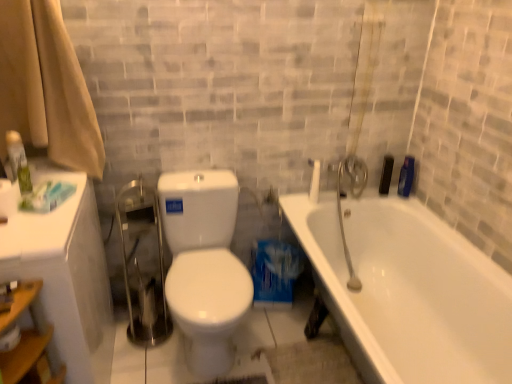
Locate an element on the screen. Image resolution: width=512 pixels, height=384 pixels. black plastic razor at upper right, placed as the 1th toiletry when sorted from back to front is located at coordinates (386, 175).

At what (x,y) coordinates should I click in order to perform the action: click on green matte spray can at left, which is the 3th toiletry in right-to-left order. Please return your answer as a coordinate pair (x, y). Looking at the image, I should click on [x=18, y=161].

The height and width of the screenshot is (384, 512). Describe the element at coordinates (18, 161) in the screenshot. I see `green matte spray can at left, the 3th toiletry when ordered from back to front` at that location.

Find the location of a particular element. white glossy bathtub at right is located at coordinates (408, 291).

In order to face white glossy bathtub at right, should I rotate leftwards or rightwards?

Turn right by 17.511 degrees to look at white glossy bathtub at right.

Where is `white glossy medicine cabinet at left`? This screenshot has height=384, width=512. white glossy medicine cabinet at left is located at coordinates (66, 275).

At what (x,y) coordinates should I click in order to perform the action: click on white matte toilet paper at lower left. Please return your answer as a coordinate pair (x, y). Looking at the image, I should click on (10, 338).

This screenshot has height=384, width=512. I want to click on toiletry lying in front of the blue glossy bottle at upper right, the third toiletry from the left, so click(x=18, y=161).

Could you measure the distance between blue glossy bottle at upper right, acting as the 2th toiletry starting from the back, and green matte spray can at left, which is the 3th toiletry in right-to-left order?

blue glossy bottle at upper right, acting as the 2th toiletry starting from the back, and green matte spray can at left, which is the 3th toiletry in right-to-left order, are 1.74 meters apart from each other.

How many degrees apart are the facing directions of blue glossy bottle at upper right, acting as the 2th toiletry starting from the back, and green matte spray can at left, which appears as the first toiletry when viewed from the front?

84.4 degrees separate the facing orientations of blue glossy bottle at upper right, acting as the 2th toiletry starting from the back, and green matte spray can at left, which appears as the first toiletry when viewed from the front.

From the image's perspective, relative to green matte spray can at left, arranged as the first toiletry when viewed from the left, is blue glossy bottle at upper right, acting as the 2th toiletry starting from the back, above or below?

From the image's perspective, blue glossy bottle at upper right, acting as the 2th toiletry starting from the back, appears below green matte spray can at left, arranged as the first toiletry when viewed from the left.

Is beige fabric shower curtain at left in front of or behind black plastic razor at upper right, placed as the 1th toiletry when sorted from back to front, in the image?

Clearly, beige fabric shower curtain at left is in front of black plastic razor at upper right, placed as the 1th toiletry when sorted from back to front.

Considering the positions of objects beige fabric shower curtain at left and black plastic razor at upper right, which appears as the 2th toiletry when viewed from the right, in the image provided, who is more to the left, beige fabric shower curtain at left or black plastic razor at upper right, which appears as the 2th toiletry when viewed from the right,?

beige fabric shower curtain at left is more to the left.

Considering the relative sizes of beige fabric shower curtain at left and black plastic razor at upper right, placed as the 1th toiletry when sorted from back to front, in the image provided, is beige fabric shower curtain at left bigger than black plastic razor at upper right, placed as the 1th toiletry when sorted from back to front,?

Correct, beige fabric shower curtain at left is larger in size than black plastic razor at upper right, placed as the 1th toiletry when sorted from back to front.

Is beige fabric shower curtain at left aimed at black plastic razor at upper right, which is the third toiletry in front-to-back order?

No, beige fabric shower curtain at left is not aimed at black plastic razor at upper right, which is the third toiletry in front-to-back order.

From the image's perspective, is blue glossy bottle at upper right, arranged as the second toiletry when viewed from the front, beneath white glossy bathtub at right?

No, from the image's perspective, blue glossy bottle at upper right, arranged as the second toiletry when viewed from the front, is not beneath white glossy bathtub at right.

Is the position of blue glossy bottle at upper right, acting as the 2th toiletry starting from the back, more distant than that of white glossy bathtub at right?

Yes, it is.

Based on the photo, is blue glossy bottle at upper right, the 1th toiletry when ordered from right to left, placed right next to white glossy bathtub at right?

blue glossy bottle at upper right, the 1th toiletry when ordered from right to left, and white glossy bathtub at right are clearly separated.

Considering the relative sizes of white glossy medicine cabinet at left and white glossy bathtub at right in the image provided, is white glossy medicine cabinet at left thinner than white glossy bathtub at right?

Correct, the width of white glossy medicine cabinet at left is less than that of white glossy bathtub at right.

Considering the relative sizes of white glossy medicine cabinet at left and white glossy bathtub at right in the image provided, is white glossy medicine cabinet at left taller than white glossy bathtub at right?

Indeed, white glossy medicine cabinet at left has a greater height compared to white glossy bathtub at right.

Is white glossy medicine cabinet at left spatially inside white glossy bathtub at right, or outside of it?

The correct answer is: outside.

From a real-world perspective, does white glossy medicine cabinet at left sit lower than white glossy bathtub at right?

Incorrect, from a real-world perspective, white glossy medicine cabinet at left is higher than white glossy bathtub at right.

From a real-world perspective, relative to white glossy medicine cabinet at left, is blue glossy bottle at upper right, arranged as the second toiletry when viewed from the front, vertically above or below?

From a real-world perspective, blue glossy bottle at upper right, arranged as the second toiletry when viewed from the front, is physically above white glossy medicine cabinet at left.

How different are the orientations of blue glossy bottle at upper right, the 1th toiletry when ordered from right to left, and white glossy medicine cabinet at left in degrees?

The facing directions of blue glossy bottle at upper right, the 1th toiletry when ordered from right to left, and white glossy medicine cabinet at left are 90 degrees apart.

Does blue glossy bottle at upper right, the third toiletry from the left, come behind white glossy medicine cabinet at left?

Yes, it is behind white glossy medicine cabinet at left.

Consider the image. Does blue glossy bottle at upper right, acting as the 2th toiletry starting from the back, have a lesser height compared to white glossy medicine cabinet at left?

Indeed, blue glossy bottle at upper right, acting as the 2th toiletry starting from the back, has a lesser height compared to white glossy medicine cabinet at left.

Find the location of a particular element. The image size is (512, 384). toilet located on the left of white glossy bathtub at right is located at coordinates (204, 266).

Could you tell me if white glossy bathtub at right is facing white glossy toilet at center?

No.

In the scene shown: Which point is more forward, (319, 228) or (187, 212)?

The point (187, 212) is more forward.

Image resolution: width=512 pixels, height=384 pixels. There is a white glossy toilet at center. What are the coordinates of `the 2nd toiletry above it (from a real-world perspective)` in the screenshot? It's located at (406, 177).

Can you tell me how much white glossy toilet at center and blue glossy bottle at upper right, the third toiletry from the left, differ in facing direction?

The facing directions of white glossy toilet at center and blue glossy bottle at upper right, the third toiletry from the left, are 0.000193 degrees apart.

Visually, is white glossy toilet at center positioned to the left or to the right of blue glossy bottle at upper right, the third toiletry from the left?

Based on their positions, white glossy toilet at center is located to the left of blue glossy bottle at upper right, the third toiletry from the left.

Is white glossy toilet at center in front of blue glossy bottle at upper right, the 1th toiletry when ordered from right to left?

Yes, it is.

The height and width of the screenshot is (384, 512). What are the coordinates of `toiletry that is the 2nd object located below the green matte spray can at left, which is the 3th toiletry in right-to-left order (from the image's perspective)` in the screenshot? It's located at (406, 177).

The image size is (512, 384). I want to click on shower curtain above the black plastic razor at upper right, placed as the 1th toiletry when sorted from back to front (from the image's perspective), so click(46, 87).

When comparing their distances from white matte toilet paper at lower left, does black plastic razor at upper right, the 2th toiletry positioned from the left, or white glossy toilet at center seem closer?

Among the two, white glossy toilet at center is located nearer to white matte toilet paper at lower left.

Considering their positions, is beige fabric shower curtain at left positioned closer to white glossy toilet at center than green matte spray can at left, the 3th toiletry when ordered from back to front?

Among the two, beige fabric shower curtain at left is located nearer to white glossy toilet at center.

Looking at the image, which one is located further to white glossy medicine cabinet at left, white glossy toilet at center or white glossy bathtub at right?

The object further to white glossy medicine cabinet at left is white glossy bathtub at right.

Considering their positions, is white matte toilet paper at lower left positioned closer to beige fabric shower curtain at left than white glossy toilet at center?

white glossy toilet at center.

From the image, which object appears to be farther from green matte spray can at left, arranged as the first toiletry when viewed from the left, blue glossy bottle at upper right, the 1th toiletry when ordered from right to left, or white glossy bathtub at right?

The object further to green matte spray can at left, arranged as the first toiletry when viewed from the left, is blue glossy bottle at upper right, the 1th toiletry when ordered from right to left.

Estimate the real-world distances between objects in this image. Which object is closer to white glossy bathtub at right, white glossy toilet at center or white matte toilet paper at lower left?

white glossy toilet at center is positioned closer to the anchor white glossy bathtub at right.

Looking at the image, which one is located closer to white glossy bathtub at right, beige fabric shower curtain at left or white matte toilet paper at lower left?

Among the two, beige fabric shower curtain at left is located nearer to white glossy bathtub at right.

From the image, which object appears to be nearer to beige fabric shower curtain at left, white glossy bathtub at right or black plastic razor at upper right, the 2th toiletry positioned from the left?

white glossy bathtub at right lies closer to beige fabric shower curtain at left than the other object.

The image size is (512, 384). I want to click on toiletry situated between beige fabric shower curtain at left and blue glossy bottle at upper right, acting as the 2th toiletry starting from the back, from left to right, so click(386, 175).

At what (x,y) coordinates should I click in order to perform the action: click on toilet paper between white glossy medicine cabinet at left and blue glossy bottle at upper right, acting as the 2th toiletry starting from the back. Please return your answer as a coordinate pair (x, y). Looking at the image, I should click on (10, 338).

Locate an element on the screen. The image size is (512, 384). toilet paper located between green matte spray can at left, the 3th toiletry when ordered from back to front, and white glossy bathtub at right in the left-right direction is located at coordinates (10, 338).

The image size is (512, 384). I want to click on toilet situated between green matte spray can at left, the 3th toiletry when ordered from back to front, and black plastic razor at upper right, which appears as the 2th toiletry when viewed from the right, from left to right, so click(x=204, y=266).